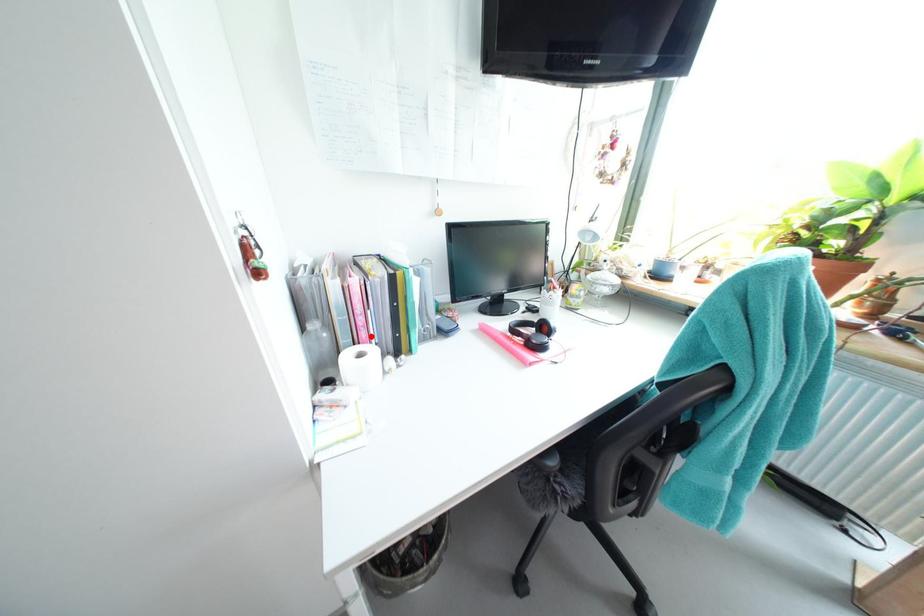
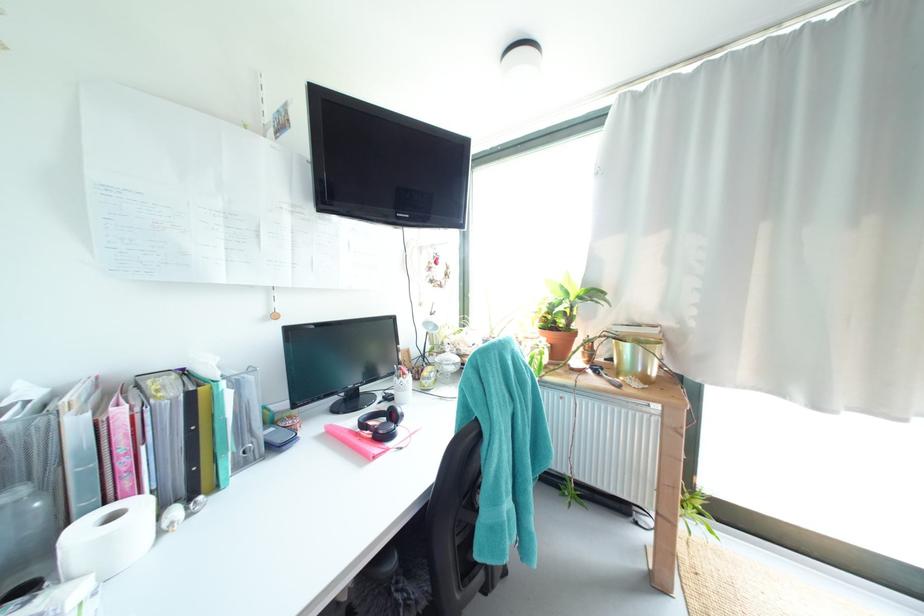
Find the pixel in the second image that matches the highlighted location in the first image.

(135, 485)